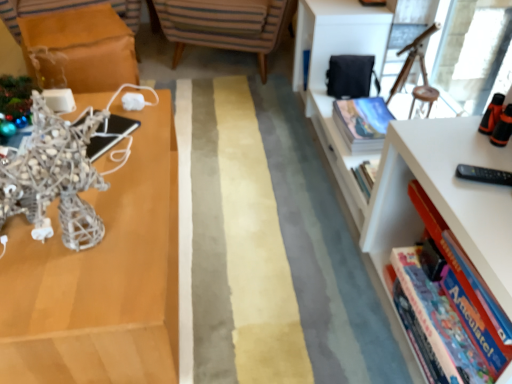
Locate an element on the screen. spots to the right of matte silver sculpture at left is located at coordinates [260, 269].